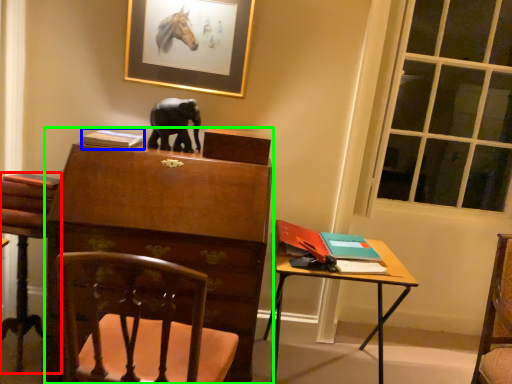
Question: Considering the real-world distances, which object is closest to chair (highlighted by a red box)? book (highlighted by a blue box) or chest of drawers (highlighted by a green box).

Choices:
 (A) book
 (B) chest of drawers

Answer: (B)